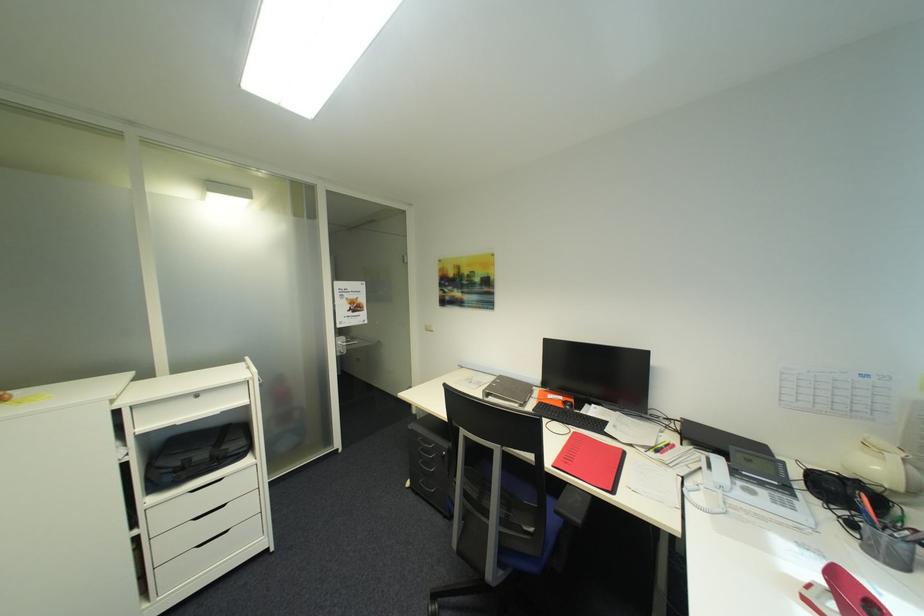
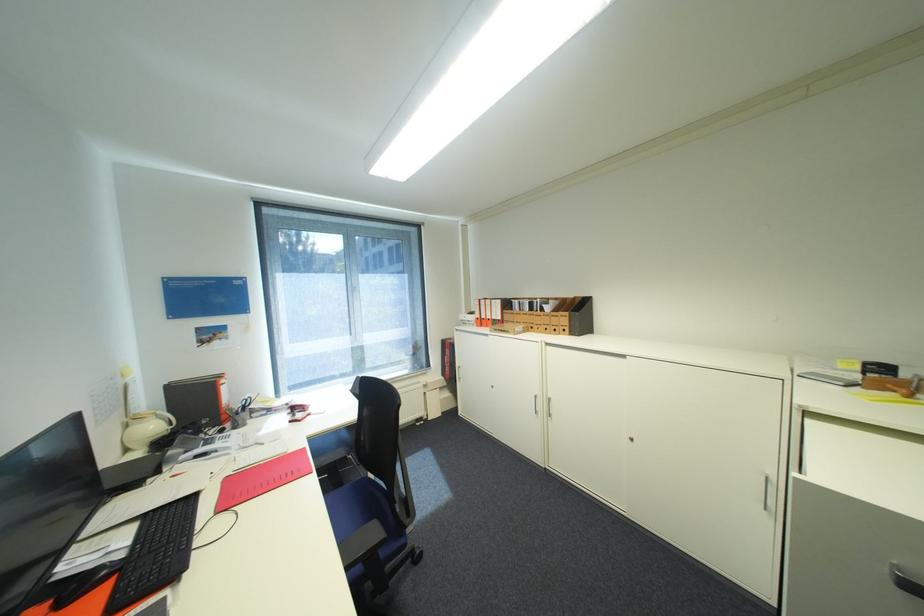
Locate, in the second image, the point that corresponds to point 886,469 in the first image.

(161, 427)